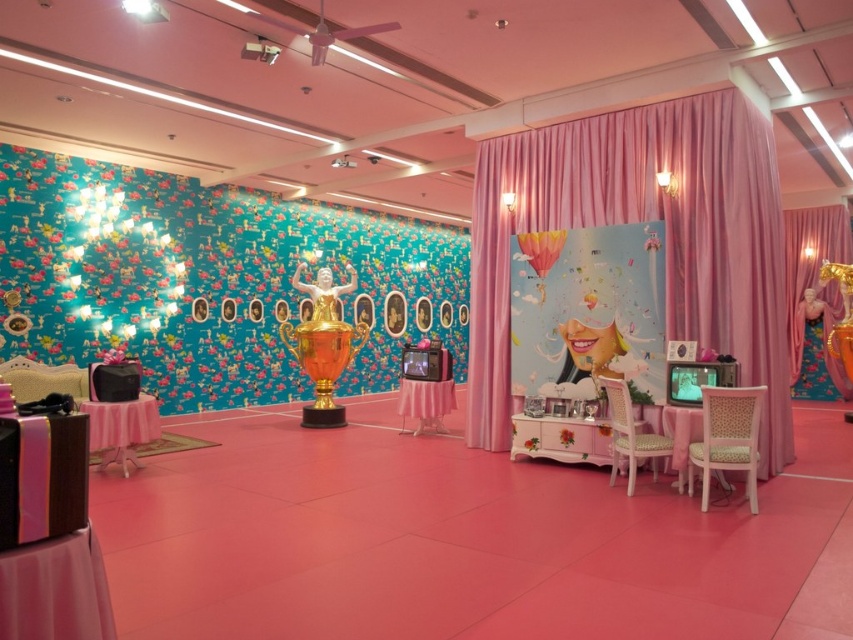
You are planning to hang a new decoration in the room. The velvet pink curtain at center and the matte pink balloon at center are already present. Which one is taller and thus might block the view of the other if placed behind it?

The velvet pink curtain at center is taller than the matte pink balloon at center, so placing it behind the balloon would block its view.

You are a guest at the event and want to sit on the matte pink chair at lower right. To reach it, you must first navigate around the velvet pink curtain at center. Is the chair located behind the curtain or in front of it?

The matte pink chair at lower right is behind the velvet pink curtain at center, so you need to go around the curtain to reach it.

Consider the image. You are standing in the center of the room. Which direction should you walk to reach the wooden chair at lower right?

You should walk towards the lower right direction to reach the wooden chair at lower right.